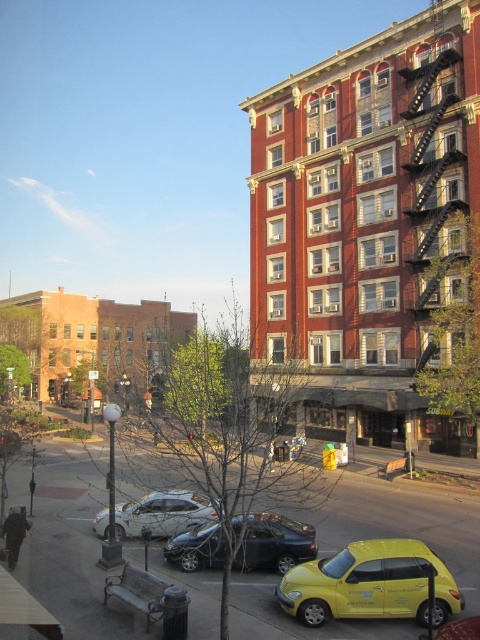
Who is lower down, shiny black sedan at center or silver metallic sedan at center?

silver metallic sedan at center is below.

Which is more to the left, shiny black sedan at center or silver metallic sedan at center?

Positioned to the left is silver metallic sedan at center.

The image size is (480, 640). Identify the location of shiny black sedan at center. (275, 541).

Where is `shiny black sedan at center`? This screenshot has width=480, height=640. shiny black sedan at center is located at coordinates (275, 541).

Is yellow matte hatchback at lower right positioned behind silver metallic sedan at center?

That is False.

Which of these two, yellow matte hatchback at lower right or silver metallic sedan at center, stands taller?

Standing taller between the two is yellow matte hatchback at lower right.

Is point (348, 582) positioned after point (178, 497)?

That is False.

This screenshot has width=480, height=640. Find the location of `yellow matte hatchback at lower right`. yellow matte hatchback at lower right is located at coordinates (370, 584).

Is yellow matte hatchback at lower right wider than shiny black sedan at center?

Indeed, yellow matte hatchback at lower right has a greater width compared to shiny black sedan at center.

Describe the element at coordinates (370, 584) in the screenshot. I see `yellow matte hatchback at lower right` at that location.

In order to click on yellow matte hatchback at lower right in this screenshot , I will do `click(370, 584)`.